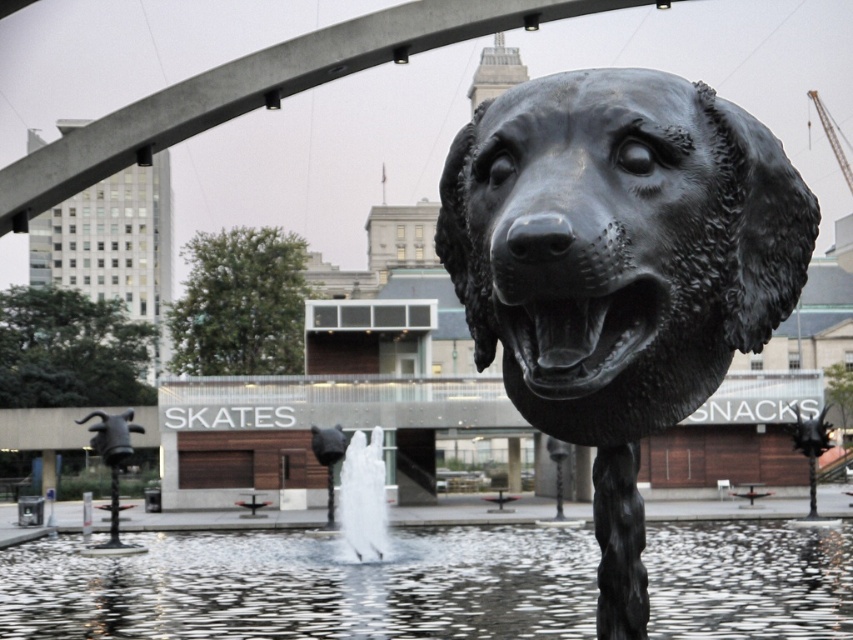
You are a visitor standing in front of the sculpture. You notice the black polished dog head at center and the white frothy water at center. Which object is located above the other?

The black polished dog head at center is positioned over the white frothy water at center.

You are standing in the urban scene described. There is a point marked at coordinates (306, 586). What is located at this point?

The point at coordinates (306, 586) marks clear water at center.

You are standing in the urban scene described. There is a point marked at coordinates (619, 244). What object is located at this point?

The point at coordinates (619, 244) marks the location of the black polished dog head at center.